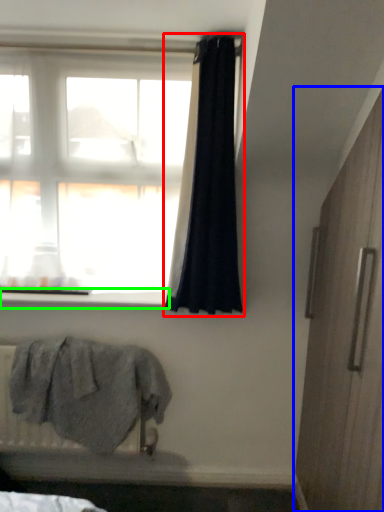
Question: Which object is the farthest from curtain (highlighted by a red box)? Choose among these: screen door (highlighted by a blue box) or window sill (highlighted by a green box).

Choices:
 (A) screen door
 (B) window sill

Answer: (A)